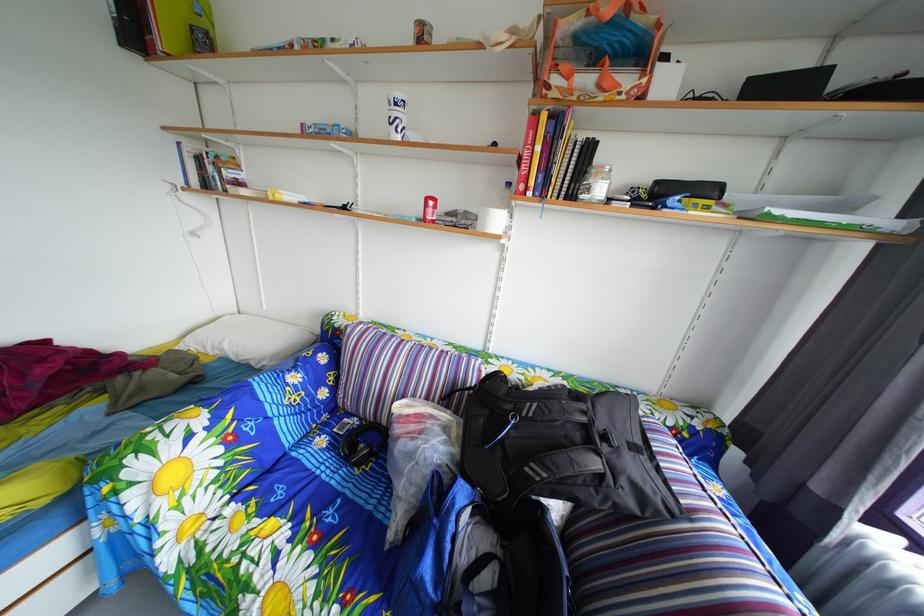
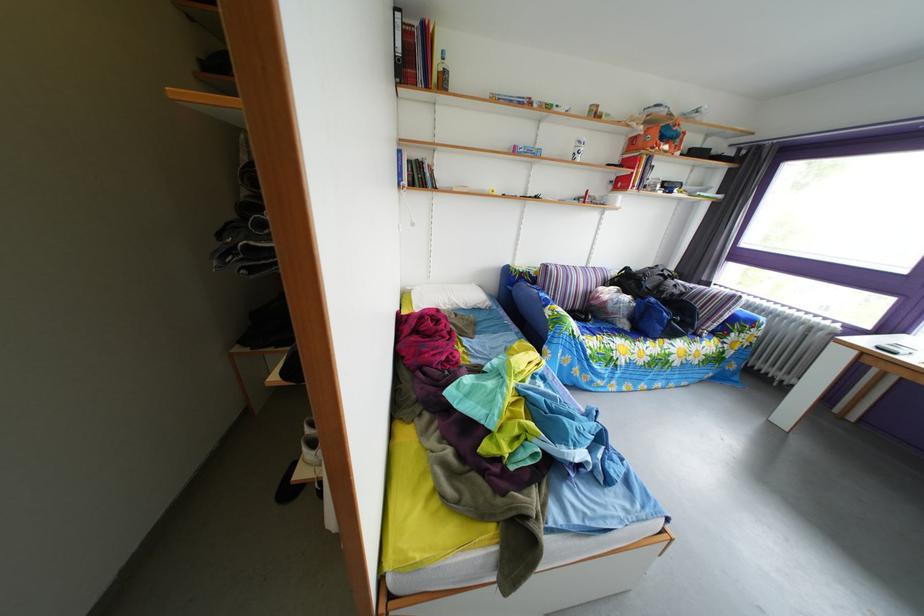
Find the pixel in the second image that matches point (497, 349) in the first image.

(599, 270)